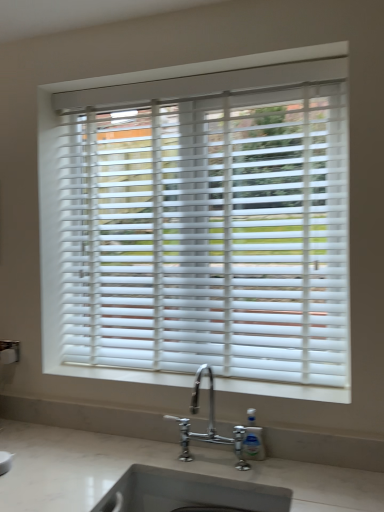
Describe the element at coordinates (200, 229) in the screenshot. I see `white matte blinds at center` at that location.

Describe the element at coordinates (253, 439) in the screenshot. I see `clear plastic soap dispenser at lower center` at that location.

What is the approximate width of white marble sink at lower center?

46.14 centimeters.

Find the location of a particular element. This screenshot has width=384, height=512. white matte blinds at center is located at coordinates (200, 229).

From a real-world perspective, which is physically above, white matte blinds at center or white matte window sill at center?

In real-world perspective, white matte blinds at center is above.

Is white matte blinds at center bigger than white matte window sill at center?

Yes.

Which object is closer to the camera taking this photo, white matte blinds at center or white matte window sill at center?

white matte window sill at center.

Does white matte blinds at center turn towards white matte window sill at center?

Yes, white matte blinds at center is facing white matte window sill at center.

Considering the relative positions of chrome metallic faucet at lower center and white matte blinds at center in the image provided, is chrome metallic faucet at lower center behind white matte blinds at center?

No, chrome metallic faucet at lower center is closer to the camera.

Looking at their sizes, would you say chrome metallic faucet at lower center is wider or thinner than white matte blinds at center?

Considering their sizes, chrome metallic faucet at lower center looks broader than white matte blinds at center.

Does point (242, 458) appear closer or farther from the camera than point (88, 270)?

Point (242, 458) is positioned closer to the camera compared to point (88, 270).

Are chrome metallic faucet at lower center and white matte blinds at center making contact?

There is a gap between chrome metallic faucet at lower center and white matte blinds at center.

Considering the sizes of objects chrome metallic faucet at lower center and white matte window sill at center in the image provided, who is taller, chrome metallic faucet at lower center or white matte window sill at center?

chrome metallic faucet at lower center.

From the image's perspective, relative to white matte window sill at center, is chrome metallic faucet at lower center above or below?

Based on their image positions, chrome metallic faucet at lower center is located beneath white matte window sill at center.

Which object is positioned more to the left, chrome metallic faucet at lower center or white matte window sill at center?

white matte window sill at center.

Find the location of `window blind behind the chrome metallic faucet at lower center`. window blind behind the chrome metallic faucet at lower center is located at coordinates (200, 229).

Is white matte blinds at center far away from chrome metallic faucet at lower center?

No, there isn't a large distance between white matte blinds at center and chrome metallic faucet at lower center.

Considering the relative sizes of white matte blinds at center and chrome metallic faucet at lower center in the image provided, is white matte blinds at center thinner than chrome metallic faucet at lower center?

Indeed, white matte blinds at center has a lesser width compared to chrome metallic faucet at lower center.

Measure the distance from white matte blinds at center to chrome metallic faucet at lower center.

white matte blinds at center is 22.70 inches from chrome metallic faucet at lower center.

In the scene shown: From the image's perspective, would you say clear plastic soap dispenser at lower center is shown under white matte window sill at center?

Yes.

Considering the sizes of objects clear plastic soap dispenser at lower center and white matte window sill at center in the image provided, who is wider, clear plastic soap dispenser at lower center or white matte window sill at center?

Wider between the two is white matte window sill at center.

From a real-world perspective, does chrome metallic faucet at lower center sit lower than clear plastic soap dispenser at lower center?

Incorrect, from a real-world perspective, chrome metallic faucet at lower center is higher than clear plastic soap dispenser at lower center.

The height and width of the screenshot is (512, 384). In order to click on soap dispenser below the chrome metallic faucet at lower center (from the image's perspective) in this screenshot , I will do [x=253, y=439].

Is chrome metallic faucet at lower center next to clear plastic soap dispenser at lower center?

No, chrome metallic faucet at lower center is not in contact with clear plastic soap dispenser at lower center.

Considering the relative sizes of chrome metallic faucet at lower center and clear plastic soap dispenser at lower center in the image provided, is chrome metallic faucet at lower center smaller than clear plastic soap dispenser at lower center?

Actually, chrome metallic faucet at lower center might be larger than clear plastic soap dispenser at lower center.

Who is shorter, clear plastic soap dispenser at lower center or white matte blinds at center?

With less height is clear plastic soap dispenser at lower center.

Between point (253, 435) and point (266, 370), which one is positioned behind?

The point (266, 370) is more distant.

From a real-world perspective, is clear plastic soap dispenser at lower center physically located above or below white matte blinds at center?

From a real-world perspective, clear plastic soap dispenser at lower center is physically below white matte blinds at center.

This screenshot has height=512, width=384. In order to click on window blind on the right of the white matte window sill at center in this screenshot , I will do pyautogui.click(x=200, y=229).

The width and height of the screenshot is (384, 512). In the image, there is a white matte blinds at center. What are the coordinates of `tap below it (from a real-world perspective)` in the screenshot? It's located at [x=209, y=425].

From the image, which object appears to be farther from white matte blinds at center, white marble sink at lower center or white matte window sill at center?

white marble sink at lower center.

Based on their spatial positions, is white matte blinds at center or white marble sink at lower center further from clear plastic soap dispenser at lower center?

white matte blinds at center.

Estimate the real-world distances between objects in this image. Which object is closer to white matte blinds at center, white marble sink at lower center or chrome metallic faucet at lower center?

chrome metallic faucet at lower center.

Looking at the image, which one is located closer to chrome metallic faucet at lower center, white marble sink at lower center or white matte blinds at center?

Based on the image, white marble sink at lower center appears to be nearer to chrome metallic faucet at lower center.

When comparing their distances from white matte blinds at center, does white marble sink at lower center or clear plastic soap dispenser at lower center seem closer?

white marble sink at lower center lies closer to white matte blinds at center than the other object.

When comparing their distances from clear plastic soap dispenser at lower center, does chrome metallic faucet at lower center or white marble sink at lower center seem closer?

Among the two, chrome metallic faucet at lower center is located nearer to clear plastic soap dispenser at lower center.

Which object lies further to the anchor point chrome metallic faucet at lower center, clear plastic soap dispenser at lower center or white matte window sill at center?

white matte window sill at center.

Considering their positions, is white matte window sill at center positioned further to white marble sink at lower center than clear plastic soap dispenser at lower center?

Among the two, white matte window sill at center is located further to white marble sink at lower center.

In order to click on window sill between white matte blinds at center and chrome metallic faucet at lower center from top to bottom in this screenshot , I will do `click(284, 389)`.

Locate an element on the screen. tap between white matte blinds at center and clear plastic soap dispenser at lower center in the vertical direction is located at coordinates (209, 425).

You are a GUI agent. You are given a task and a screenshot of the screen. Output one action in this format:
    pyautogui.click(x=<x>, y=<y>)
    Task: Click on the tap that lies between white matte blinds at center and white marble sink at lower center from top to bottom
    
    Given the screenshot: What is the action you would take?
    pyautogui.click(x=209, y=425)

You are a GUI agent. You are given a task and a screenshot of the screen. Output one action in this format:
    pyautogui.click(x=<x>, y=<y>)
    Task: Click on the window sill between white matte blinds at center and clear plastic soap dispenser at lower center from top to bottom
    
    Given the screenshot: What is the action you would take?
    pyautogui.click(x=284, y=389)